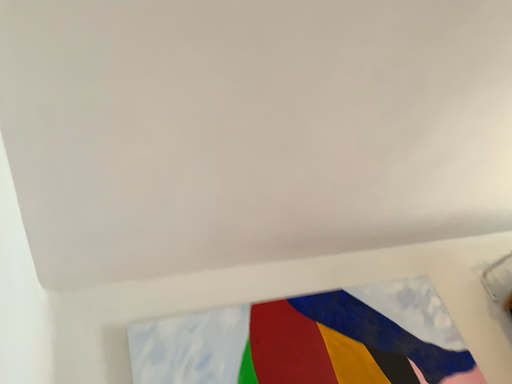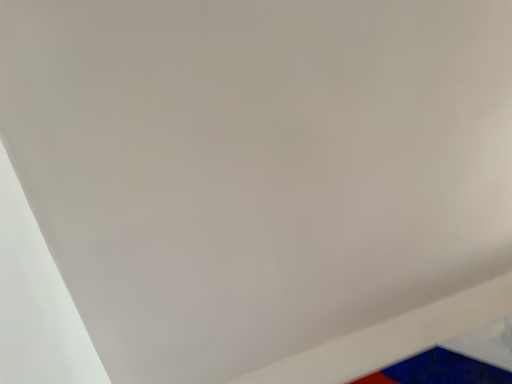
Question: Which way did the camera rotate in the video?

Choices:
 (A) rotated left
 (B) rotated right

Answer: (A)